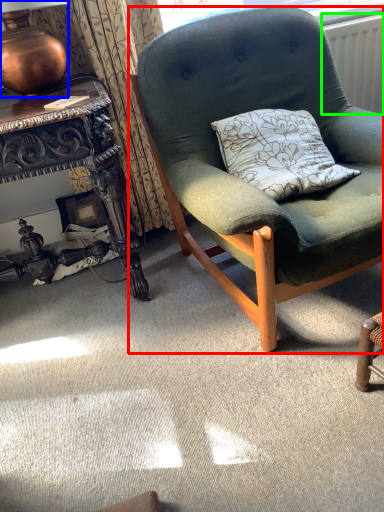
Question: Which object is the farthest from chair (highlighted by a red box)? Choose among these: lamp (highlighted by a blue box) or radiator (highlighted by a green box).

Choices:
 (A) lamp
 (B) radiator

Answer: (B)